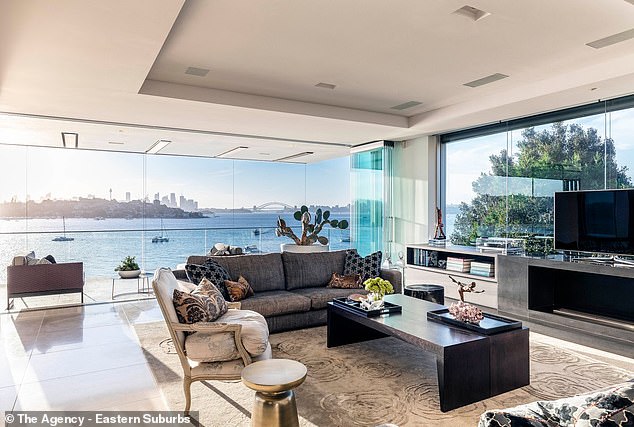
Find the location of `tile floor`. tile floor is located at coordinates (115, 370).